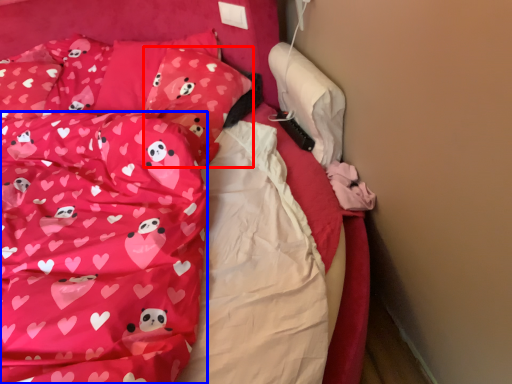
Question: Among these objects, which one is nearest to the camera, pillow (highlighted by a red box) or blanket (highlighted by a blue box)?

Choices:
 (A) pillow
 (B) blanket

Answer: (B)